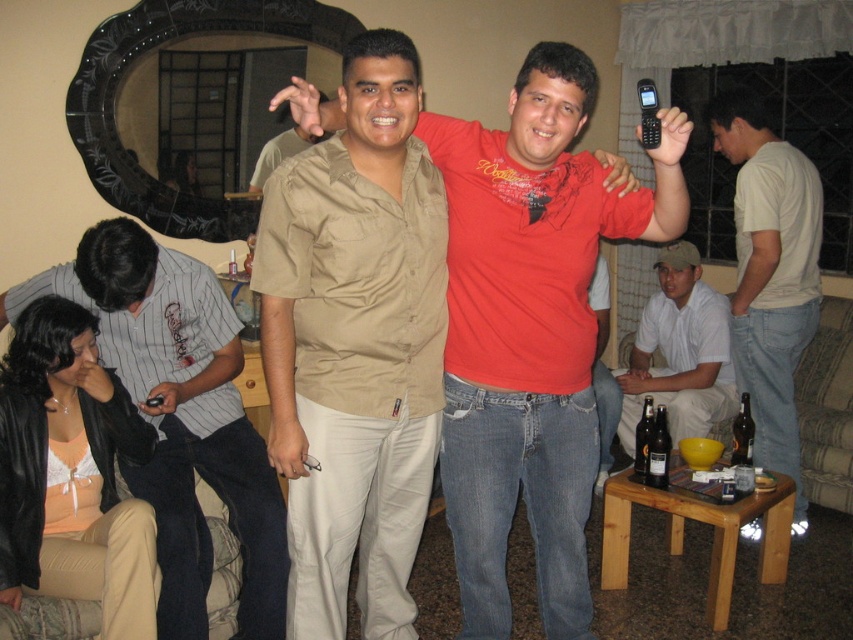
Does striped cotton shirt at lower left appear on the left side of white cotton shirt at lower right?

Correct, you'll find striped cotton shirt at lower left to the left of white cotton shirt at lower right.

Between point (178, 348) and point (650, 388), which one is positioned behind?

The point (650, 388) is more distant.

What do you see at coordinates (180, 417) in the screenshot?
I see `striped cotton shirt at lower left` at bounding box center [180, 417].

Image resolution: width=853 pixels, height=640 pixels. Find the location of `striped cotton shirt at lower left`. striped cotton shirt at lower left is located at coordinates (180, 417).

Does striped cotton shirt at lower left have a smaller size compared to white cotton t-shirt at right?

Actually, striped cotton shirt at lower left might be larger than white cotton t-shirt at right.

Between striped cotton shirt at lower left and white cotton t-shirt at right, which one has more height?

white cotton t-shirt at right is taller.

What do you see at coordinates (180, 417) in the screenshot?
I see `striped cotton shirt at lower left` at bounding box center [180, 417].

This screenshot has width=853, height=640. Find the location of `striped cotton shirt at lower left`. striped cotton shirt at lower left is located at coordinates (180, 417).

Can you confirm if white cotton t-shirt at right is positioned to the left of white cotton shirt at lower right?

In fact, white cotton t-shirt at right is to the right of white cotton shirt at lower right.

Which is in front, point (741, 129) or point (720, 356)?

Point (741, 129) is more forward.

Find the location of `white cotton t-shirt at right`. white cotton t-shirt at right is located at coordinates (770, 275).